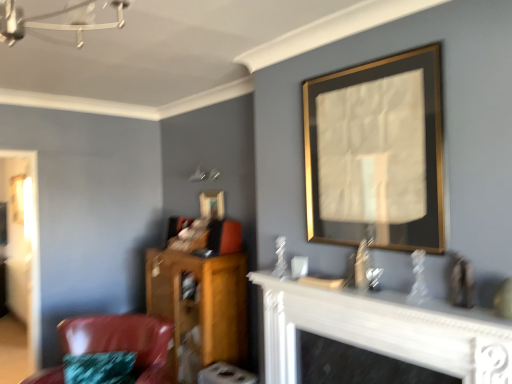
Where is `vacant area on top of gold/metallic picture frame at upper right, acting as the 2th picture frame starting from the left (from a real-world perspective)`? The height and width of the screenshot is (384, 512). vacant area on top of gold/metallic picture frame at upper right, acting as the 2th picture frame starting from the left (from a real-world perspective) is located at coordinates click(366, 61).